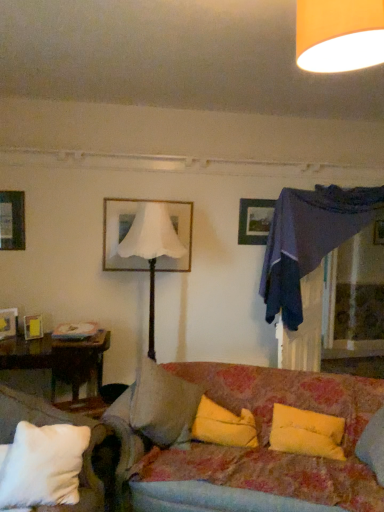
This screenshot has height=512, width=384. What do you see at coordinates (306, 433) in the screenshot? I see `yellow fabric pillow at center, arranged as the 3th pillow when viewed from the left` at bounding box center [306, 433].

How much space does wooden picture frame at left, which is the 4th picture frame in right-to-left order, occupy vertically?

The height of wooden picture frame at left, which is the 4th picture frame in right-to-left order, is 9.88 inches.

Image resolution: width=384 pixels, height=512 pixels. What do you see at coordinates (42, 466) in the screenshot?
I see `white soft pillow at lower left, positioned as the first pillow in left-to-right order` at bounding box center [42, 466].

What do you see at coordinates (299, 407) in the screenshot? I see `floral fabric couch at center` at bounding box center [299, 407].

What do you see at coordinates (353, 297) in the screenshot? The width and height of the screenshot is (384, 512). I see `transparent glass door at upper right` at bounding box center [353, 297].

Image resolution: width=384 pixels, height=512 pixels. What do you see at coordinates (129, 230) in the screenshot?
I see `white matte picture frame at upper center, marked as the first picture frame in a right-to-left arrangement` at bounding box center [129, 230].

How much space does white matte picture frame at upper center, marked as the first picture frame in a right-to-left arrangement, occupy horizontally?

white matte picture frame at upper center, marked as the first picture frame in a right-to-left arrangement, is 2.22 inches wide.

Find the location of a particular element. Image resolution: width=384 pixels, height=512 pixels. yellow fabric pillow at center, arranged as the 3th pillow when viewed from the left is located at coordinates (306, 433).

Is yellow fabric pillow at center, which ranks as the second pillow in right-to-left order, facing away from white fabric lampshade at center, the second lamp when ordered from top to bottom?

No, yellow fabric pillow at center, which ranks as the second pillow in right-to-left order, is not facing away from white fabric lampshade at center, the second lamp when ordered from top to bottom.

From the picture: Which of these two, yellow fabric pillow at center, which ranks as the second pillow in right-to-left order, or white fabric lampshade at center, arranged as the second lamp when viewed from the right, stands taller?

Standing taller between the two is white fabric lampshade at center, arranged as the second lamp when viewed from the right.

Is yellow fabric pillow at center, which appears as the second pillow when viewed from the left, placed right next to white fabric lampshade at center, arranged as the second lamp when viewed from the right?

There is a gap between yellow fabric pillow at center, which appears as the second pillow when viewed from the left, and white fabric lampshade at center, arranged as the second lamp when viewed from the right.

Which is in front, point (227, 445) or point (140, 250)?

Positioned in front is point (227, 445).

Is point (1, 361) closer to viewer compared to point (321, 55)?

No, (1, 361) is further to viewer.

Looking at this image, is orange fabric lampshade at upper center, acting as the first lamp starting from the top, at the back of brown wooden table at lower left?

No, brown wooden table at lower left is not facing away from orange fabric lampshade at upper center, acting as the first lamp starting from the top.

Could you measure the distance between brown wooden table at lower left and orange fabric lampshade at upper center, which appears as the 2th lamp when ordered from the bottom?

They are 8.74 feet apart.

Looking at this image, from a real-world perspective, is brown wooden table at lower left under orange fabric lampshade at upper center, which is the 2th lamp from left to right?

Yes, from a real-world perspective, brown wooden table at lower left is under orange fabric lampshade at upper center, which is the 2th lamp from left to right.

From the image's perspective, which is below, transparent glass door at upper right or orange fabric lampshade at upper center, which is counted as the 1th lamp, starting from the right?

transparent glass door at upper right, from the image's perspective.

Considering the positions of objects transparent glass door at upper right and orange fabric lampshade at upper center, acting as the first lamp starting from the top, in the image provided, who is more to the left, transparent glass door at upper right or orange fabric lampshade at upper center, acting as the first lamp starting from the top,?

Positioned to the left is orange fabric lampshade at upper center, acting as the first lamp starting from the top.

Find the location of a particular element. glass door below the orange fabric lampshade at upper center, acting as the first lamp starting from the top (from a real-world perspective) is located at coordinates (353, 297).

The height and width of the screenshot is (512, 384). Identify the location of pillow on the left of yellow fabric pillow at center, which ranks as the second pillow in right-to-left order. (42, 466).

From the picture: Is yellow fabric pillow at center, which appears as the second pillow when viewed from the left, spatially inside white soft pillow at lower left, positioned as the first pillow in left-to-right order, or outside of it?

yellow fabric pillow at center, which appears as the second pillow when viewed from the left, is outside white soft pillow at lower left, positioned as the first pillow in left-to-right order.

Can you confirm if yellow fabric pillow at center, which ranks as the second pillow in right-to-left order, is thinner than white soft pillow at lower left, positioned as the first pillow in left-to-right order?

Correct, the width of yellow fabric pillow at center, which ranks as the second pillow in right-to-left order, is less than that of white soft pillow at lower left, positioned as the first pillow in left-to-right order.

In the scene shown: Considering the sizes of objects wooden picture frame at lower left, acting as the third picture frame starting from the left, and transparent glass door at upper right in the image provided, who is thinner, wooden picture frame at lower left, acting as the third picture frame starting from the left, or transparent glass door at upper right?

wooden picture frame at lower left, acting as the third picture frame starting from the left.

Identify the location of the 3rd picture frame in front of the transparent glass door at upper right. (33, 327).

Between wooden picture frame at lower left, marked as the second picture frame in a right-to-left arrangement, and transparent glass door at upper right, which one has smaller size?

wooden picture frame at lower left, marked as the second picture frame in a right-to-left arrangement.

How many degrees apart are the facing directions of yellow fabric pillow at center, which ranks as the second pillow in right-to-left order, and dark blue fabric canopy bed at upper right?

The angular difference between yellow fabric pillow at center, which ranks as the second pillow in right-to-left order, and dark blue fabric canopy bed at upper right is 57 degrees.

Is yellow fabric pillow at center, which appears as the second pillow when viewed from the left, smaller than dark blue fabric canopy bed at upper right?

Correct, yellow fabric pillow at center, which appears as the second pillow when viewed from the left, occupies less space than dark blue fabric canopy bed at upper right.

From the image's perspective, is yellow fabric pillow at center, which appears as the second pillow when viewed from the left, over dark blue fabric canopy bed at upper right?

No, from the image's perspective, yellow fabric pillow at center, which appears as the second pillow when viewed from the left, is not above dark blue fabric canopy bed at upper right.

Considering the relative positions of yellow fabric pillow at center, which ranks as the second pillow in right-to-left order, and dark blue fabric canopy bed at upper right in the image provided, is yellow fabric pillow at center, which ranks as the second pillow in right-to-left order, to the right of dark blue fabric canopy bed at upper right from the viewer's perspective?

No.

From a real-world perspective, is wooden picture frame at lower left, marked as the second picture frame in a right-to-left arrangement, located beneath brown wooden table at lower left?

No.

Are wooden picture frame at lower left, acting as the third picture frame starting from the left, and brown wooden table at lower left making contact?

They are not placed beside each other.

Considering the positions of objects wooden picture frame at lower left, marked as the second picture frame in a right-to-left arrangement, and brown wooden table at lower left in the image provided, who is in front, wooden picture frame at lower left, marked as the second picture frame in a right-to-left arrangement, or brown wooden table at lower left?

Positioned in front is brown wooden table at lower left.

Is wooden picture frame at lower left, marked as the second picture frame in a right-to-left arrangement, looking in the opposite direction of brown wooden table at lower left?

wooden picture frame at lower left, marked as the second picture frame in a right-to-left arrangement, does not have its back to brown wooden table at lower left.

Find the location of a particular element. the 3rd pillow directly beneath the white fabric lampshade at center, which is the 1th lamp from back to front (from a real-world perspective) is located at coordinates (223, 426).

Where is `table on the left of orange fabric lampshade at upper center, which ranks as the first lamp in front-to-back order`? This screenshot has width=384, height=512. table on the left of orange fabric lampshade at upper center, which ranks as the first lamp in front-to-back order is located at coordinates (59, 359).

Estimate the real-world distances between objects in this image. Which object is closer to transparent glass door at upper right, floral fabric couch at center or wooden picture frame at lower left, marked as the second picture frame in a right-to-left arrangement?

Among the two, floral fabric couch at center is located nearer to transparent glass door at upper right.

Looking at the image, which one is located further to metallic silver picture frame at upper left, the third picture frame when ordered from right to left, white soft pillow at lower left, the 3th pillow from the right, or transparent glass door at upper right?

The object further to metallic silver picture frame at upper left, the third picture frame when ordered from right to left, is transparent glass door at upper right.

Considering their positions, is brown wooden table at lower left positioned further to transparent glass door at upper right than yellow fabric pillow at center, which appears as the second pillow when viewed from the left?

brown wooden table at lower left is further to transparent glass door at upper right.

Estimate the real-world distances between objects in this image. Which object is closer to yellow fabric pillow at center, which ranks as the second pillow in right-to-left order, brown wooden table at lower left or transparent glass door at upper right?

The object closer to yellow fabric pillow at center, which ranks as the second pillow in right-to-left order, is brown wooden table at lower left.

Which object lies further to the anchor point brown wooden table at lower left, dark blue fabric canopy bed at upper right or yellow fabric pillow at center, arranged as the 3th pillow when viewed from the left?

Based on the image, dark blue fabric canopy bed at upper right appears to be further to brown wooden table at lower left.

Based on their spatial positions, is orange fabric lampshade at upper center, which is counted as the 1th lamp, starting from the right, or white soft pillow at lower left, positioned as the first pillow in left-to-right order, further from metallic silver picture frame at upper left, the 2th picture frame in the left-to-right sequence?

orange fabric lampshade at upper center, which is counted as the 1th lamp, starting from the right, lies further to metallic silver picture frame at upper left, the 2th picture frame in the left-to-right sequence, than the other object.

From the picture: Considering their positions, is metallic silver picture frame at upper left, the third picture frame when ordered from right to left, positioned further to white fabric lampshade at center, the second lamp in the front-to-back sequence, than wooden picture frame at left, which is the 4th picture frame in right-to-left order?

wooden picture frame at left, which is the 4th picture frame in right-to-left order.

Based on their spatial positions, is orange fabric lampshade at upper center, acting as the first lamp starting from the top, or brown wooden table at lower left closer to white soft pillow at lower left, positioned as the first pillow in left-to-right order?

brown wooden table at lower left.

At what (x,y) coordinates should I click in order to perform the action: click on lamp between metallic silver picture frame at upper left, the third picture frame when ordered from right to left, and yellow fabric pillow at center, which appears as the second pillow when viewed from the left, from left to right. Please return your answer as a coordinate pair (x, y). Looking at the image, I should click on (152, 249).

Locate an element on the screen. This screenshot has height=512, width=384. canopy bed between yellow fabric pillow at center, arranged as the 3th pillow when viewed from the left, and transparent glass door at upper right in the front-back direction is located at coordinates (309, 240).

I want to click on lamp between white soft pillow at lower left, positioned as the first pillow in left-to-right order, and wooden picture frame at lower left, acting as the third picture frame starting from the left, in the front-back direction, so click(152, 249).

I want to click on table between wooden picture frame at left, which is the 4th picture frame in right-to-left order, and yellow fabric pillow at center, which is the 1th pillow from right to left, in the horizontal direction, so click(x=59, y=359).